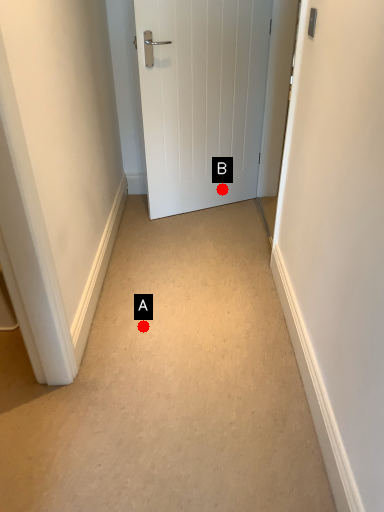
Question: Two points are circled on the image, labeled by A and B beside each circle. Which point is further to the camera?

Choices:
 (A) A is further
 (B) B is further

Answer: (B)